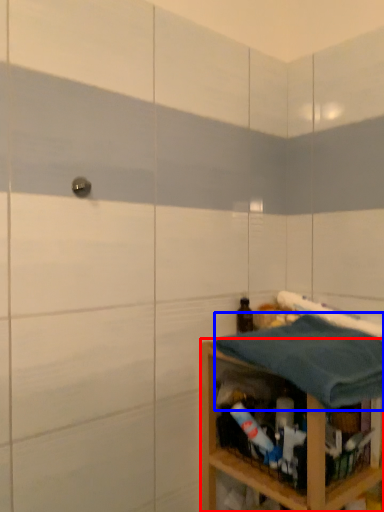
Question: Which point is further to the camera, shelf (highlighted by a red box) or bath towel (highlighted by a blue box)?

Choices:
 (A) shelf
 (B) bath towel

Answer: (A)